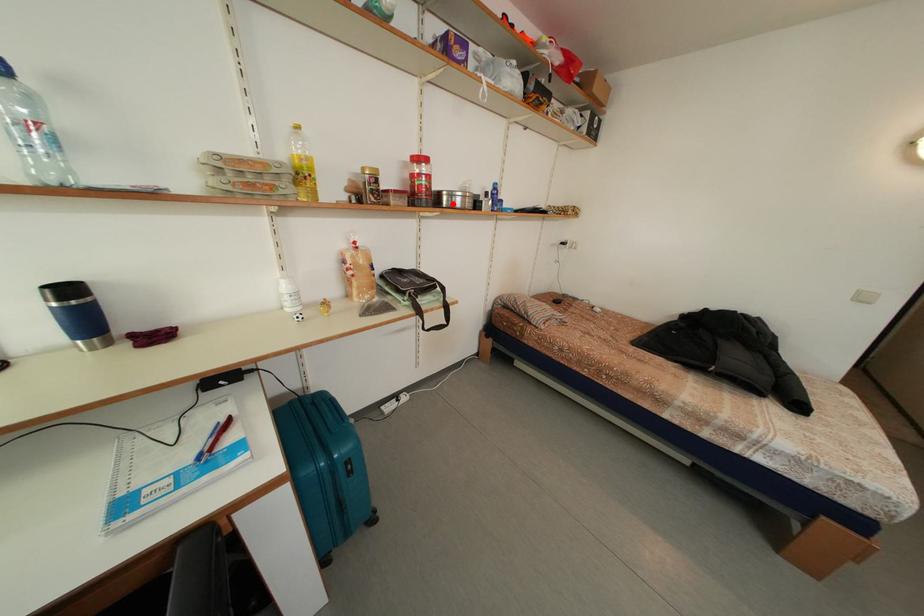
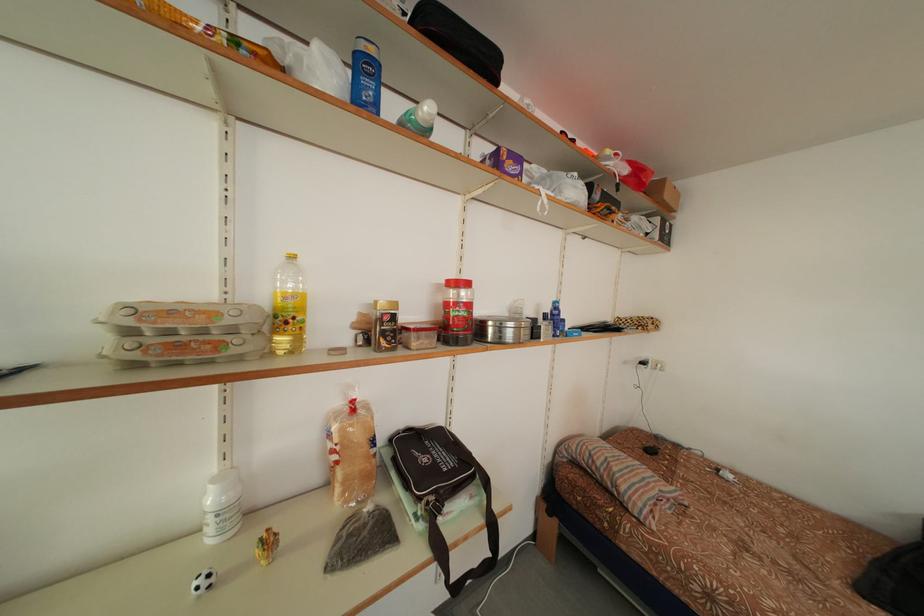
Question: I am providing you with two images of the same scene from different viewpoints. A red point is marked on the first image. At the location where the point appears in image 1, is it still visible in image 2?

Choices:
 (A) Yes
 (B) No

Answer: (A)